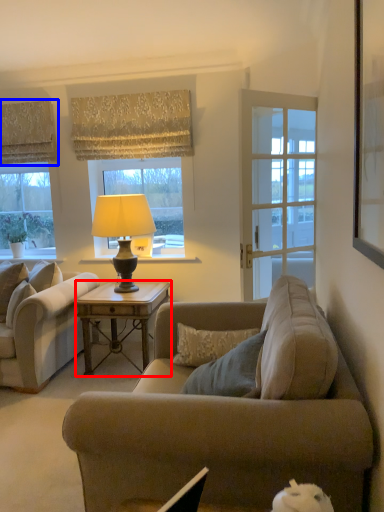
Question: Which point is closer to the camera, desk (highlighted by a red box) or curtain (highlighted by a blue box)?

Choices:
 (A) desk
 (B) curtain

Answer: (A)